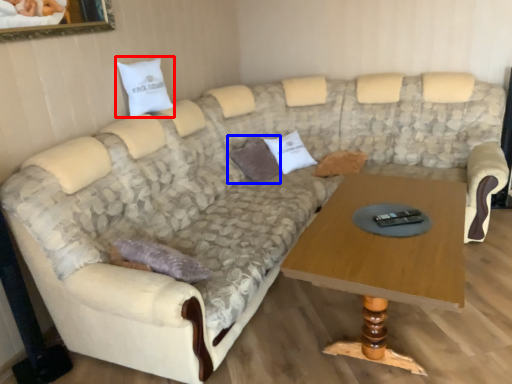
Question: Which object is further to the camera taking this photo, pillow (highlighted by a red box) or pillow (highlighted by a blue box)?

Choices:
 (A) pillow
 (B) pillow

Answer: (B)